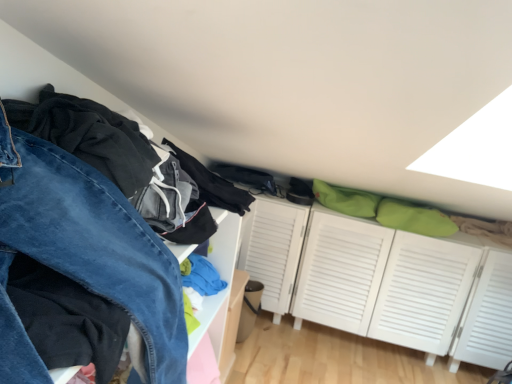
Question: Should I look upward or downward to see denim pants at left?

Choices:
 (A) up
 (B) down

Answer: (B)

Question: Considering the relative sizes of denim pants at left and white louvered cabinet at center in the image provided, is denim pants at left smaller than white louvered cabinet at center?

Choices:
 (A) no
 (B) yes

Answer: (B)

Question: Is denim pants at left thinner than white louvered cabinet at center?

Choices:
 (A) no
 (B) yes

Answer: (B)

Question: Can you confirm if denim pants at left is bigger than white louvered cabinet at center?

Choices:
 (A) yes
 (B) no

Answer: (B)

Question: Does denim pants at left lie in front of white louvered cabinet at center?

Choices:
 (A) yes
 (B) no

Answer: (A)

Question: Could you tell me if denim pants at left is turned towards white louvered cabinet at center?

Choices:
 (A) yes
 (B) no

Answer: (B)

Question: From a real-world perspective, is denim pants at left physically below white louvered cabinet at center?

Choices:
 (A) yes
 (B) no

Answer: (B)

Question: Does white louvered cabinet at center have a greater height compared to denim pants at left?

Choices:
 (A) no
 (B) yes

Answer: (A)

Question: Are white louvered cabinet at center and denim pants at left making contact?

Choices:
 (A) no
 (B) yes

Answer: (A)

Question: From a real-world perspective, is white louvered cabinet at center physically below denim pants at left?

Choices:
 (A) yes
 (B) no

Answer: (A)

Question: Is white louvered cabinet at center smaller than denim pants at left?

Choices:
 (A) yes
 (B) no

Answer: (B)

Question: Does white louvered cabinet at center have a lesser width compared to denim pants at left?

Choices:
 (A) yes
 (B) no

Answer: (B)

Question: Is white louvered cabinet at center aimed at denim pants at left?

Choices:
 (A) no
 (B) yes

Answer: (B)

Question: Is white louvered cabinet at center in front of or behind denim pants at left in the image?

Choices:
 (A) front
 (B) behind

Answer: (B)